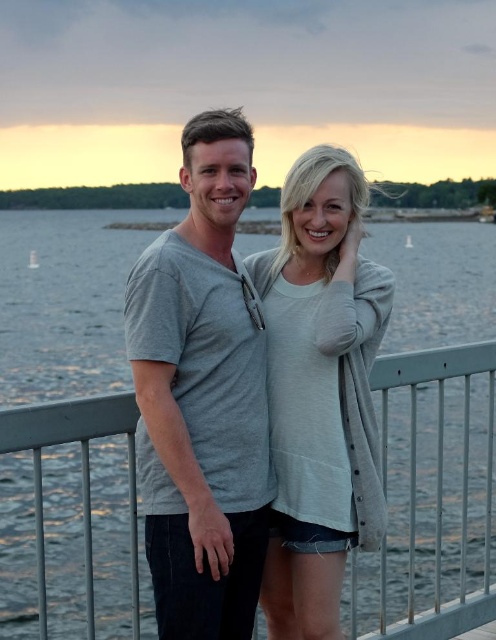
Question: Estimate the real-world distances between objects in this image. Which object is closer to the gray matte t-shirt at center?

Choices:
 (A) gray metallic rail at center
 (B) gray soft sweater at center

Answer: (B)

Question: Observing the image, what is the correct spatial positioning of gray matte t-shirt at center in reference to gray soft sweater at center?

Choices:
 (A) below
 (B) above

Answer: (B)

Question: Which of these objects is positioned closest to the gray soft sweater at center?

Choices:
 (A) gray matte t-shirt at center
 (B) gray metallic rail at center

Answer: (A)

Question: Can you confirm if gray soft sweater at center is positioned below gray metallic rail at center?

Choices:
 (A) no
 (B) yes

Answer: (A)

Question: Which is nearer to the gray matte t-shirt at center?

Choices:
 (A) gray metallic rail at center
 (B) gray soft sweater at center

Answer: (B)

Question: Is gray matte t-shirt at center below gray metallic rail at center?

Choices:
 (A) no
 (B) yes

Answer: (A)